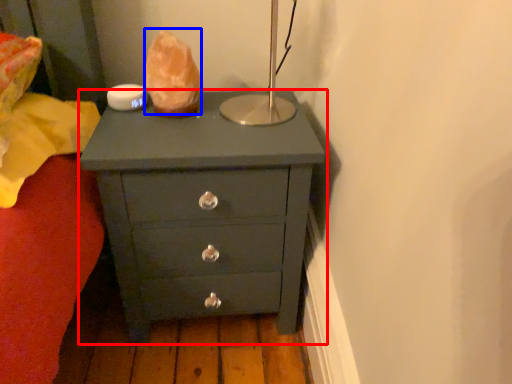
Question: Which point is closer to the camera, chest of drawers (highlighted by a red box) or food (highlighted by a blue box)?

Choices:
 (A) chest of drawers
 (B) food

Answer: (A)